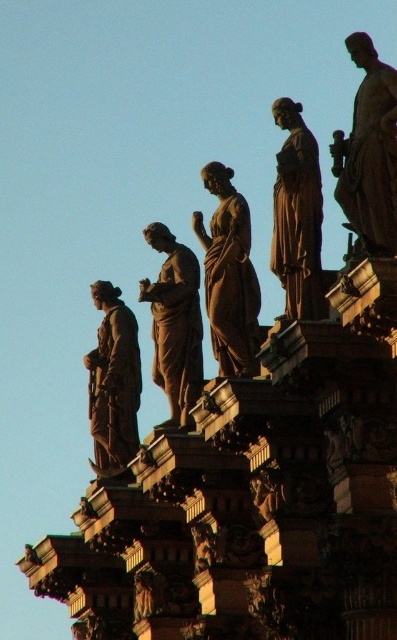
Is bronze statue at upper right shorter than bronze statue at center?

Yes, bronze statue at upper right is shorter than bronze statue at center.

Does bronze statue at upper right come behind bronze statue at center?

No, it is not.

Locate an element on the screen. bronze statue at upper right is located at coordinates (370, 152).

Does matte bronze statue at center appear under bronze statue at center?

Indeed, matte bronze statue at center is positioned under bronze statue at center.

Between matte bronze statue at center and bronze statue at center, which one appears on the left side from the viewer's perspective?

Positioned to the left is matte bronze statue at center.

Is point (217, 333) closer to viewer compared to point (310, 305)?

No, (217, 333) is further to viewer.

This screenshot has height=640, width=397. In order to click on matte bronze statue at center in this screenshot , I will do `click(229, 275)`.

Does matte bronze statue at center come in front of brown polished statue at center?

Yes, it is.

Does point (217, 308) lie in front of point (196, 284)?

Yes, point (217, 308) is in front of point (196, 284).

Between point (227, 348) and point (181, 248), which one is positioned behind?

The point (181, 248) is more distant.

Where is `matte bronze statue at center`? The width and height of the screenshot is (397, 640). matte bronze statue at center is located at coordinates (229, 275).